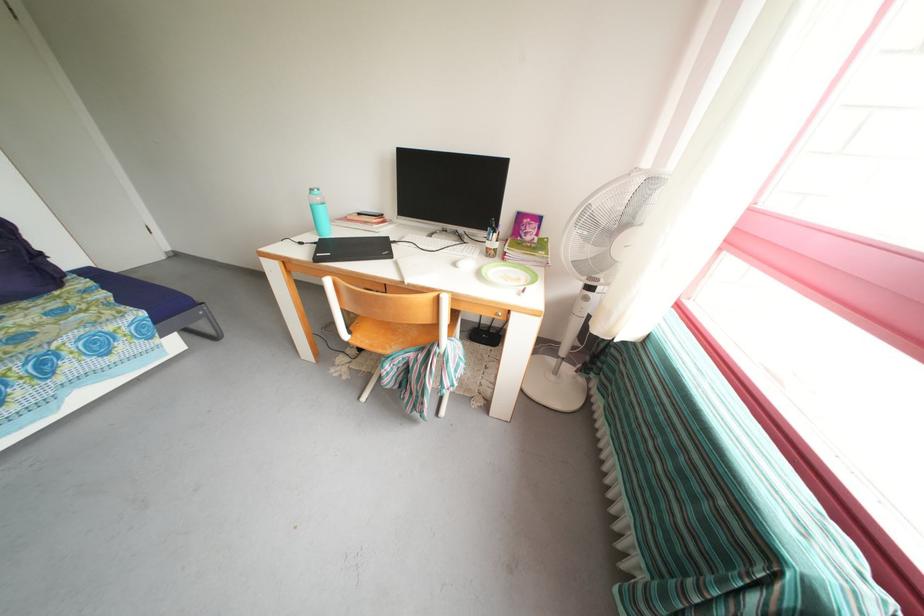
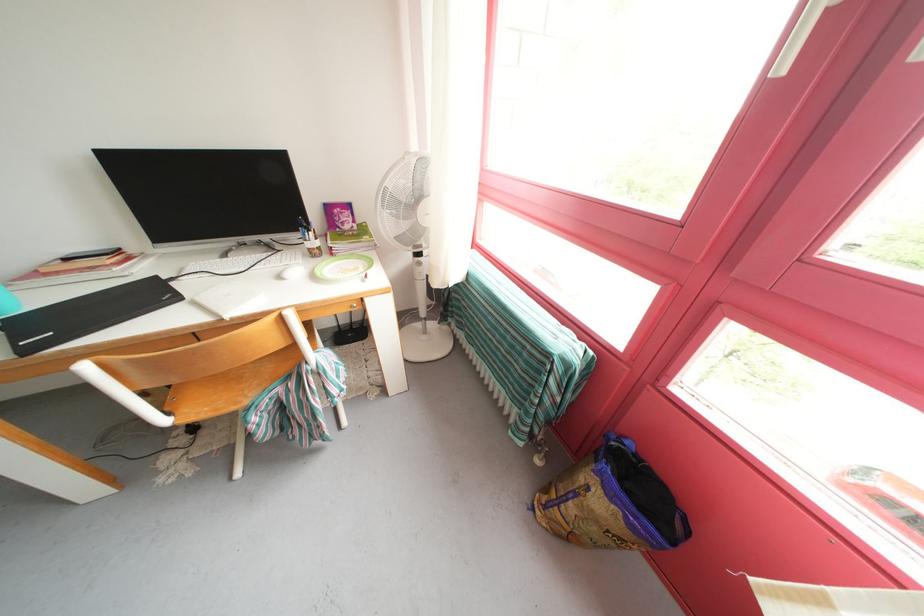
Locate, in the second image, the point that corresponds to (536,275) in the first image.

(369, 262)